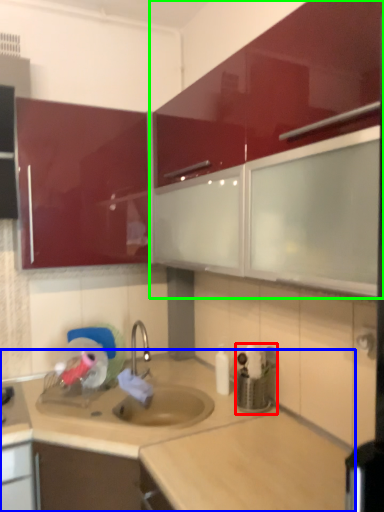
Question: Which object is the closest to the appliance (highlighted by a red box)? Choose among these: countertop (highlighted by a blue box) or cabinetry (highlighted by a green box).

Choices:
 (A) countertop
 (B) cabinetry

Answer: (A)